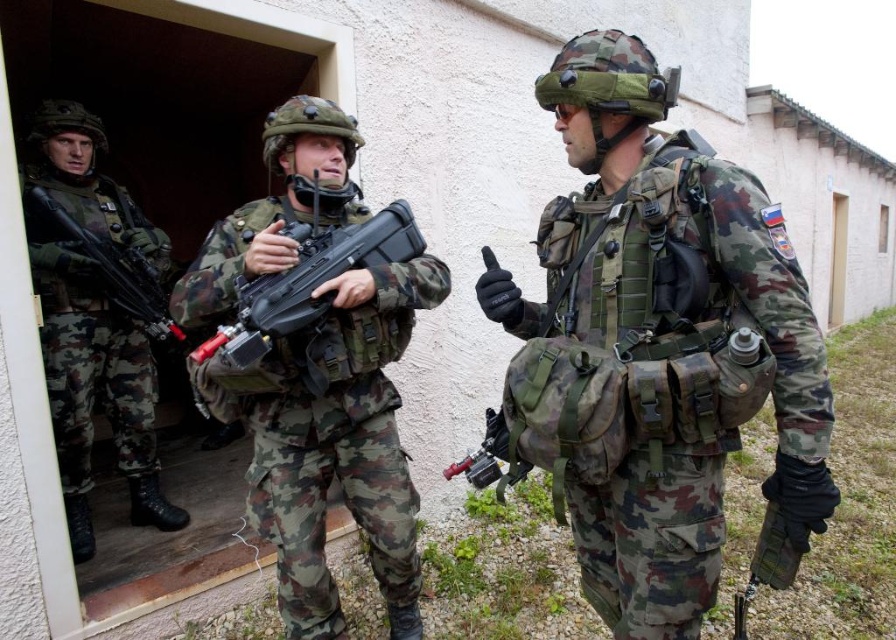
Question: Does camouflage fabric uniform at center have a larger size compared to matte black rifle at left?

Choices:
 (A) no
 (B) yes

Answer: (B)

Question: Is camouflage fabric uniform at center smaller than matte black rifle at center?

Choices:
 (A) no
 (B) yes

Answer: (A)

Question: Which point is closer to the camera taking this photo?

Choices:
 (A) (350, 228)
 (B) (39, 259)
 (C) (392, 396)
 (D) (612, 474)

Answer: (D)

Question: Which is nearer to the camouflage fabric rifle at left?

Choices:
 (A) matte black rifle at center
 (B) matte black rifle at left
 (C) camouflage uniform at center
 (D) camouflage fabric uniform at center

Answer: (B)

Question: Estimate the real-world distances between objects in this image. Which object is closer to the matte black rifle at left?

Choices:
 (A) matte black rifle at center
 (B) camouflage fabric rifle at left

Answer: (B)

Question: Can you confirm if camouflage uniform at center is bigger than matte black rifle at left?

Choices:
 (A) yes
 (B) no

Answer: (A)